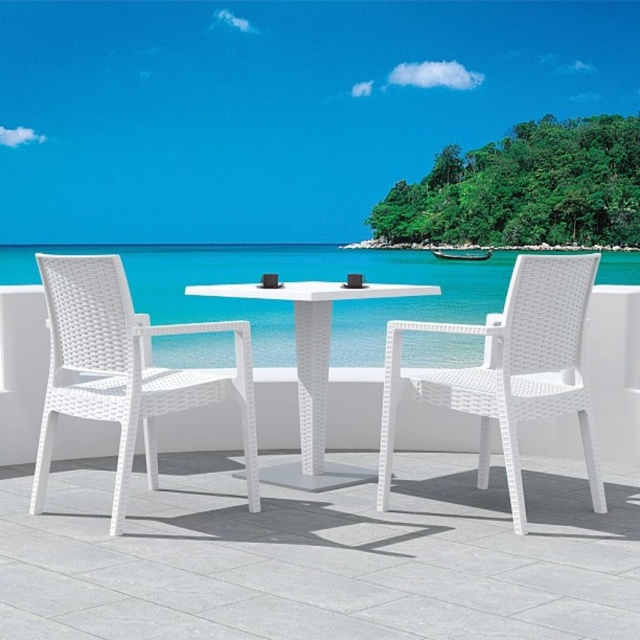
Question: Which object is farther from the camera taking this photo?

Choices:
 (A) white woven table at center
 (B) white wicker chair at left

Answer: (A)

Question: Does white wicker chair at left appear over white woven table at center?

Choices:
 (A) yes
 (B) no

Answer: (B)

Question: From the image, what is the correct spatial relationship of white wicker chair at left in relation to white woven table at center?

Choices:
 (A) right
 (B) left

Answer: (B)

Question: Estimate the real-world distances between objects in this image. Which object is closer to the white wicker chair at left?

Choices:
 (A) white woven table at center
 (B) white wicker chair at center

Answer: (A)

Question: Which object is the closest to the white wicker chair at left?

Choices:
 (A) white wicker chair at center
 (B) white woven table at center

Answer: (B)

Question: Can you confirm if white wicker chair at left is positioned to the left of white wicker chair at center?

Choices:
 (A) no
 (B) yes

Answer: (B)